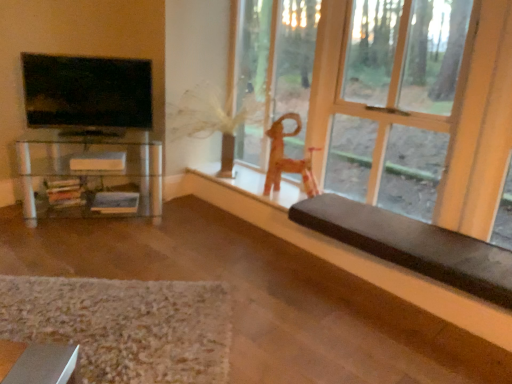
Question: Should I look upward or downward to see wooden chair at right?

Choices:
 (A) up
 (B) down

Answer: (A)

Question: Is wooden chair at right surrounded by brown cushioned bench at lower right?

Choices:
 (A) no
 (B) yes

Answer: (A)

Question: Could you tell me if brown cushioned bench at lower right is facing wooden chair at right?

Choices:
 (A) no
 (B) yes

Answer: (A)

Question: Considering the relative positions of brown cushioned bench at lower right and wooden chair at right in the image provided, is brown cushioned bench at lower right to the left of wooden chair at right from the viewer's perspective?

Choices:
 (A) no
 (B) yes

Answer: (B)

Question: Can you see brown cushioned bench at lower right touching wooden chair at right?

Choices:
 (A) yes
 (B) no

Answer: (B)

Question: Does brown cushioned bench at lower right appear on the right side of wooden chair at right?

Choices:
 (A) yes
 (B) no

Answer: (B)

Question: From a real-world perspective, is brown cushioned bench at lower right located higher than wooden chair at right?

Choices:
 (A) no
 (B) yes

Answer: (A)

Question: Does wooden toy horse at center have a lesser height compared to brown cushioned bench at lower right?

Choices:
 (A) yes
 (B) no

Answer: (B)

Question: Does wooden toy horse at center lie behind brown cushioned bench at lower right?

Choices:
 (A) no
 (B) yes

Answer: (B)

Question: Is wooden toy horse at center positioned with its back to brown cushioned bench at lower right?

Choices:
 (A) no
 (B) yes

Answer: (A)

Question: Is wooden toy horse at center in front of brown cushioned bench at lower right?

Choices:
 (A) yes
 (B) no

Answer: (B)

Question: Is wooden toy horse at center not inside brown cushioned bench at lower right?

Choices:
 (A) no
 (B) yes

Answer: (B)

Question: Does wooden toy horse at center have a greater height compared to brown cushioned bench at lower right?

Choices:
 (A) yes
 (B) no

Answer: (A)

Question: Is textured beige rug at lower left facing away from wooden chair at right?

Choices:
 (A) yes
 (B) no

Answer: (B)